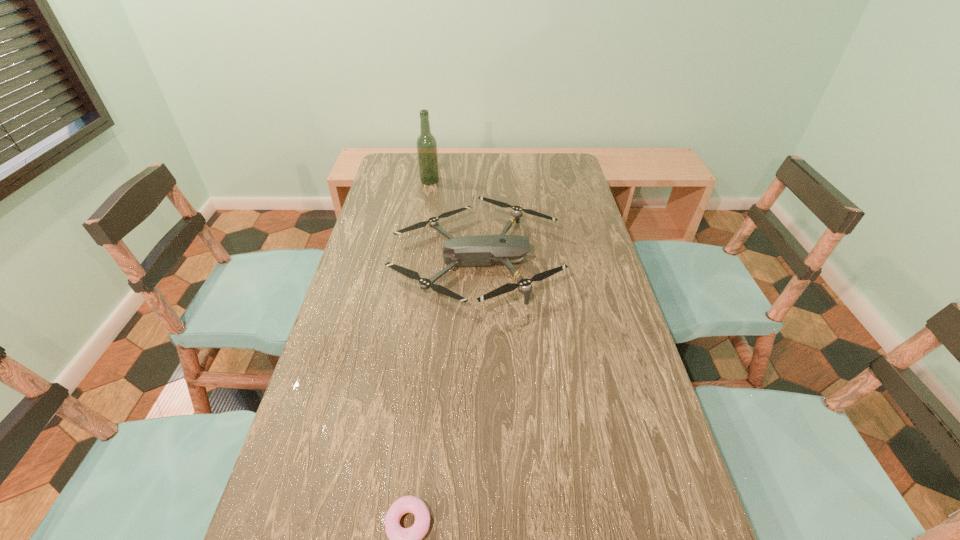
Locate an element on the screen. The height and width of the screenshot is (540, 960). the farthest object is located at coordinates (426, 143).

The height and width of the screenshot is (540, 960). I want to click on liquor, so click(426, 143).

The width and height of the screenshot is (960, 540). In order to click on drone in this screenshot , I will do `click(481, 250)`.

Locate an element on the screen. The image size is (960, 540). the second nearest object is located at coordinates pyautogui.click(x=481, y=250).

Locate an element on the screen. vacant point located 0.210m on the right of the farthest object is located at coordinates (492, 181).

Identify the location of free space located with a camera mounted on the front of the second tallest object. (598, 261).

Where is `object at the far edge`? Image resolution: width=960 pixels, height=540 pixels. object at the far edge is located at coordinates (426, 143).

Where is `liquor situated at the left edge`? Image resolution: width=960 pixels, height=540 pixels. liquor situated at the left edge is located at coordinates click(x=426, y=143).

This screenshot has width=960, height=540. I want to click on drone that is at the left edge, so click(481, 250).

The height and width of the screenshot is (540, 960). Find the location of `object positioned at the right edge`. object positioned at the right edge is located at coordinates click(x=481, y=250).